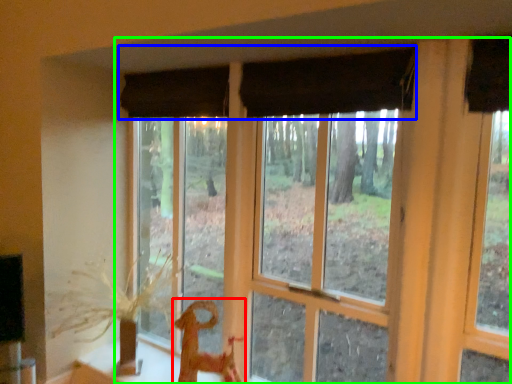
Question: Considering the real-world distances, which object is closest to animal (highlighted by a red box)? curtain (highlighted by a blue box) or window (highlighted by a green box).

Choices:
 (A) curtain
 (B) window

Answer: (B)